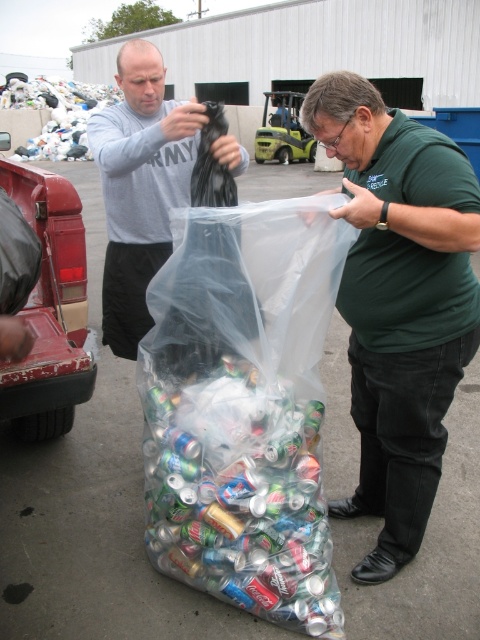
Question: Is translucent plastic bag at center above gray matte shirt at upper left?

Choices:
 (A) no
 (B) yes

Answer: (A)

Question: Based on their relative distances, which object is farther from the plastic bag at upper left?

Choices:
 (A) green matte shirt at center
 (B) translucent plastic bag at center
 (C) gray matte shirt at upper left

Answer: (C)

Question: Which object appears farthest from the camera in this image?

Choices:
 (A) green matte shirt at center
 (B) translucent plastic bag at center
 (C) plastic bag at upper left
 (D) gray matte shirt at upper left

Answer: (C)

Question: Is translucent plastic bag at center closer to camera compared to green matte shirt at center?

Choices:
 (A) yes
 (B) no

Answer: (B)

Question: Which is nearer to the gray matte shirt at upper left?

Choices:
 (A) plastic bag at upper left
 (B) green matte shirt at center
 (C) translucent plastic bag at center

Answer: (C)

Question: Does green matte shirt at center appear on the left side of plastic bag at upper left?

Choices:
 (A) no
 (B) yes

Answer: (A)